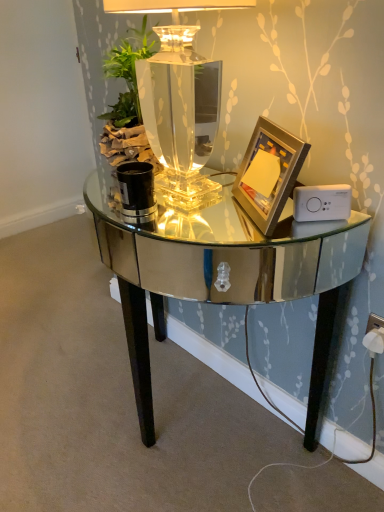
Question: In the image, is white plastic ipod at right positioned in front of or behind mirrored glass table at center?

Choices:
 (A) front
 (B) behind

Answer: (B)

Question: From the image's perspective, is white plastic ipod at right located above or below mirrored glass table at center?

Choices:
 (A) above
 (B) below

Answer: (A)

Question: Which is nearer to the clear glass table lamp at center?

Choices:
 (A) mirrored glass table at center
 (B) white plastic ipod at right
 (C) white plastic socket at lower right
 (D) gold metallic picture frame at right

Answer: (D)

Question: Which of these objects is positioned closest to the gold metallic picture frame at right?

Choices:
 (A) white plastic ipod at right
 (B) mirrored glass table at center
 (C) clear glass table lamp at center
 (D) white plastic socket at lower right

Answer: (A)